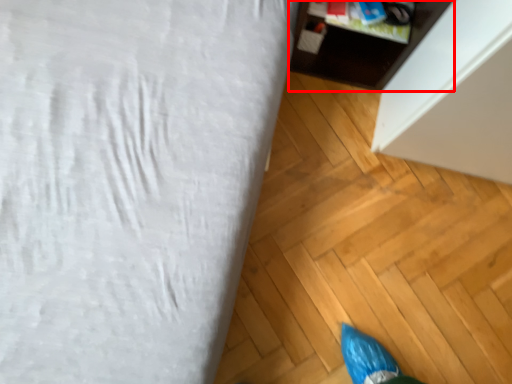
Question: Considering the relative positions of furniture (annotated by the red box) and furniture in the image provided, where is furniture (annotated by the red box) located with respect to the staircase?

Choices:
 (A) right
 (B) left

Answer: (A)